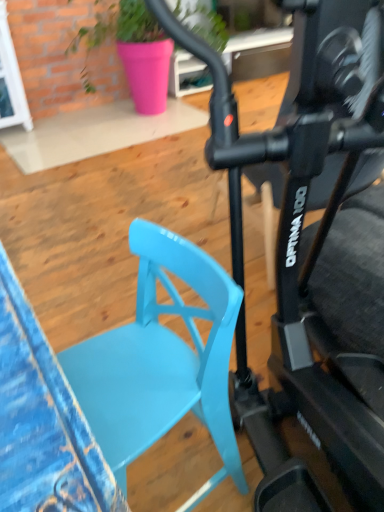
Question: Can you confirm if pink ceramic pot at upper center is bigger than matte blue chair at center-left?

Choices:
 (A) yes
 (B) no

Answer: (A)

Question: Is pink ceramic pot at upper center wider than matte blue chair at center-left?

Choices:
 (A) no
 (B) yes

Answer: (B)

Question: Does pink ceramic pot at upper center lie in front of matte blue chair at center-left?

Choices:
 (A) yes
 (B) no

Answer: (B)

Question: Could you tell me if pink ceramic pot at upper center is facing matte blue chair at center-left?

Choices:
 (A) no
 (B) yes

Answer: (B)

Question: From a real-world perspective, is pink ceramic pot at upper center located beneath matte blue chair at center-left?

Choices:
 (A) yes
 (B) no

Answer: (B)

Question: Does pink ceramic pot at upper center have a lesser height compared to matte blue chair at center-left?

Choices:
 (A) no
 (B) yes

Answer: (A)

Question: Is pink ceramic pot at upper center at the right side of matte black exercise bike at center?

Choices:
 (A) no
 (B) yes

Answer: (A)

Question: Considering the relative sizes of pink ceramic pot at upper center and matte black exercise bike at center in the image provided, is pink ceramic pot at upper center bigger than matte black exercise bike at center?

Choices:
 (A) no
 (B) yes

Answer: (B)

Question: Is pink ceramic pot at upper center with matte black exercise bike at center?

Choices:
 (A) no
 (B) yes

Answer: (A)

Question: Does pink ceramic pot at upper center contain matte black exercise bike at center?

Choices:
 (A) no
 (B) yes

Answer: (A)

Question: From the image's perspective, is pink ceramic pot at upper center over matte black exercise bike at center?

Choices:
 (A) no
 (B) yes

Answer: (B)

Question: Can you confirm if pink ceramic pot at upper center is smaller than matte black exercise bike at center?

Choices:
 (A) no
 (B) yes

Answer: (A)

Question: Does pink ceramic pot at upper center have a lesser height compared to white glossy glass door at upper left?

Choices:
 (A) yes
 (B) no

Answer: (B)